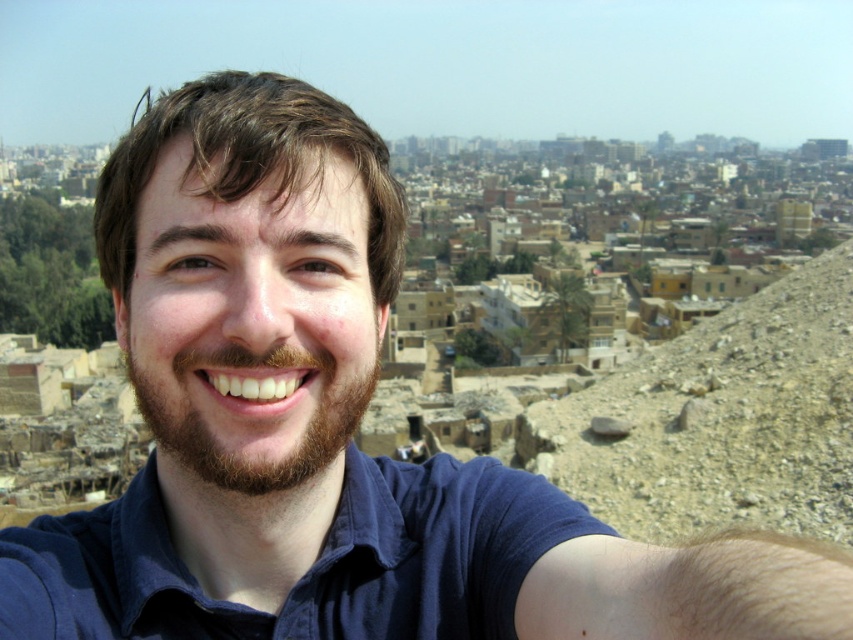
You are a photographer trying to capture a wide shot of the urban landscape in the background. You want to position yourself so that the brownwoollybeard at center is to the left of the brown rocky hillside at right in the frame. Is this possible based on their current positions?

Yes, since the brown rocky hillside at right is currently to the right of the brownwoollybeard at center, you can reposition yourself to the right side of the scene to frame the brownwoollybeard at center to the left of the brown rocky hillside at right.

You are standing at the center of the image and want to walk towards the brown rocky hillside at right. Which direction should you face to head directly towards it?

The brown rocky hillside at right is located at point [720,420], which means it is positioned to the lower right of the center. To face directly towards it, you should turn your body slightly to the right and look downward.

Based on the photo, you are planning to take a photo of the brownwoollybeard at center and the brown rocky hillside at right. Which object should you focus on first if you want to capture both in a single frame without moving the camera?

You should focus on the brownwoollybeard at center first because the brown rocky hillside at right is wider and will occupy more space in the frame, ensuring both are visible.